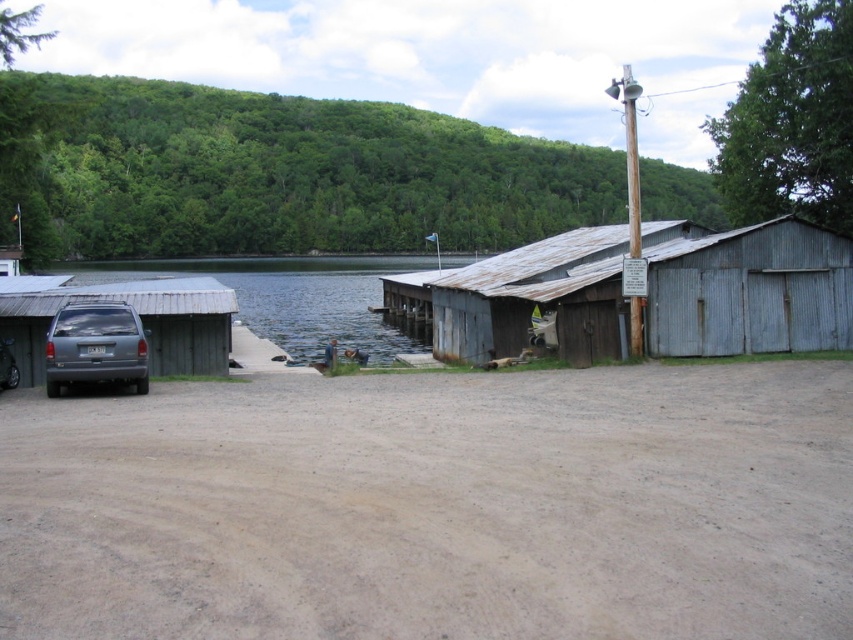
Does brown dirt track at lower center have a smaller size compared to satin gray suv at lower left?

Incorrect, brown dirt track at lower center is not smaller in size than satin gray suv at lower left.

Is brown dirt track at lower center positioned at the back of satin gray suv at lower left?

No.

Describe the element at coordinates (436, 506) in the screenshot. The height and width of the screenshot is (640, 853). I see `brown dirt track at lower center` at that location.

Where is `brown dirt track at lower center`? brown dirt track at lower center is located at coordinates (436, 506).

Locate an element on the screen. Image resolution: width=853 pixels, height=640 pixels. rusty corrugated metal barn at center-right is located at coordinates (746, 289).

Is rusty corrugated metal barn at center-right wider than clear water at dock left?

No.

You are a GUI agent. You are given a task and a screenshot of the screen. Output one action in this format:
    pyautogui.click(x=<x>, y=<y>)
    Task: Click on the rusty corrugated metal barn at center-right
    
    Given the screenshot: What is the action you would take?
    pyautogui.click(x=746, y=289)

This screenshot has width=853, height=640. In order to click on rusty corrugated metal barn at center-right in this screenshot , I will do `click(746, 289)`.

Is brown dirt track at lower center wider than rusty corrugated metal barn at center-right?

In fact, brown dirt track at lower center might be narrower than rusty corrugated metal barn at center-right.

The width and height of the screenshot is (853, 640). Identify the location of brown dirt track at lower center. (436, 506).